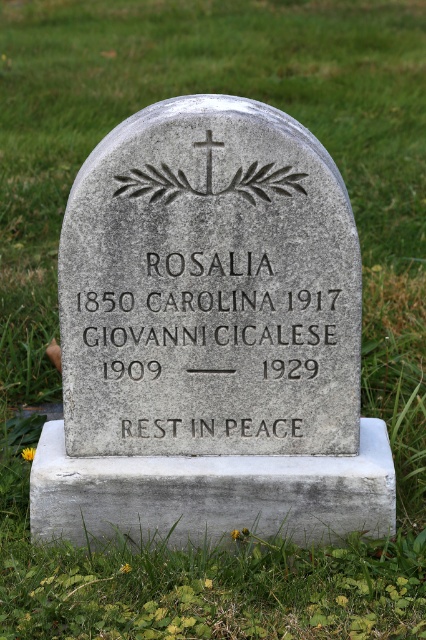
You are a visitor at a cemetery and want to take a photo of the gray stone gravestone at center and the gray stone cross at center. Since you want to capture both in the frame, which object should be closer to the camera to ensure both are visible?

The gray stone gravestone at center is much taller than the gray stone cross at center, so to include both in the photo, you should position yourself closer to the cross at center so that the taller gravestone can fit into the frame without being cut off.